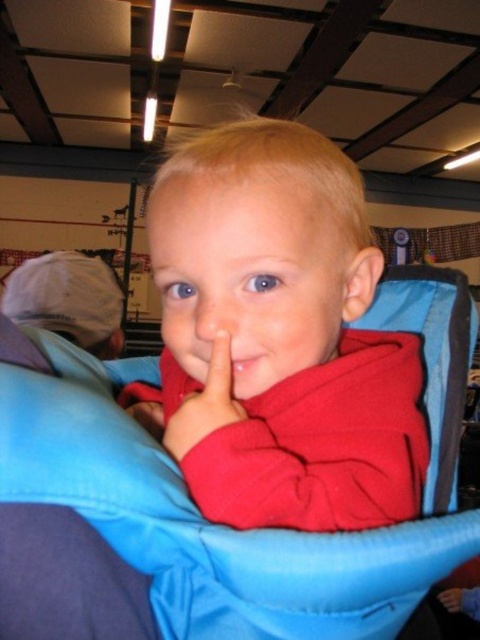
Can you confirm if red fleece at center is positioned to the right of white matte cap at upper left?

Yes, red fleece at center is to the right of white matte cap at upper left.

What do you see at coordinates (278, 337) in the screenshot?
I see `red fleece at center` at bounding box center [278, 337].

Is point (264, 291) positioned before point (118, 355)?

Yes, it is in front of point (118, 355).

You are a GUI agent. You are given a task and a screenshot of the screen. Output one action in this format:
    pyautogui.click(x=<x>, y=<y>)
    Task: Click on the red fleece at center
    This screenshot has height=640, width=480.
    Given the screenshot: What is the action you would take?
    pyautogui.click(x=278, y=337)

Which is above, white matte cap at upper left or matte red finger at center?

white matte cap at upper left is above.

Is white matte cap at upper left shorter than matte red finger at center?

In fact, white matte cap at upper left may be taller than matte red finger at center.

Locate an element on the screen. The width and height of the screenshot is (480, 640). white matte cap at upper left is located at coordinates (69, 300).

From the picture: Which is more to the right, red fleece at center or matte red finger at center?

red fleece at center

Can you confirm if red fleece at center is thinner than matte red finger at center?

No.

Does point (271, 304) lie behind point (222, 412)?

No, it is in front of (222, 412).

Identify the location of red fleece at center. click(278, 337).